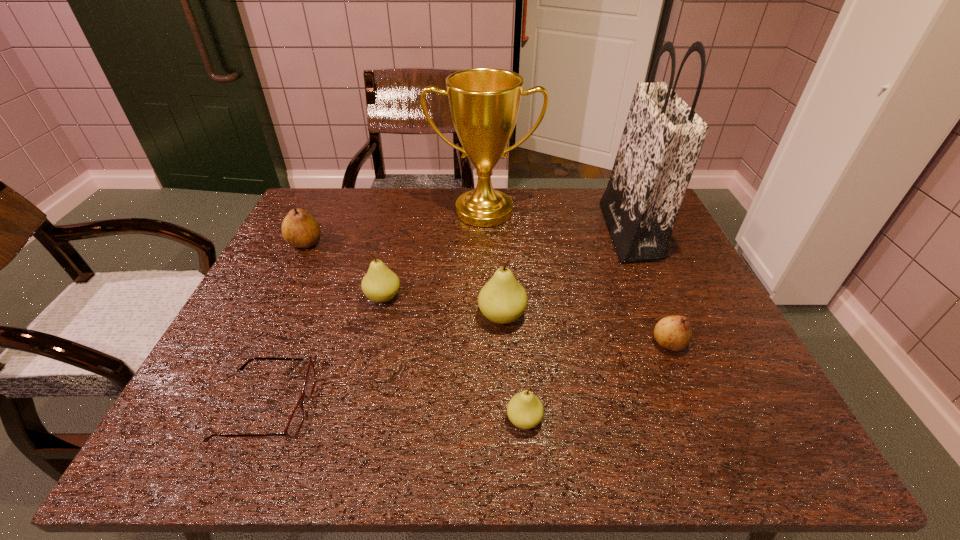
In order to click on spectacles present at the left edge in this screenshot , I will do `click(294, 424)`.

This screenshot has height=540, width=960. What are the coordinates of `shopping bag present at the right edge` in the screenshot? It's located at (662, 139).

Image resolution: width=960 pixels, height=540 pixels. Find the location of `pear located in the right edge section of the desktop`. pear located in the right edge section of the desktop is located at coordinates (674, 333).

This screenshot has width=960, height=540. Find the location of `object that is at the near left corner`. object that is at the near left corner is located at coordinates (294, 424).

Where is `object located in the far right corner section of the desktop`? This screenshot has height=540, width=960. object located in the far right corner section of the desktop is located at coordinates (662, 139).

At what (x,y) coordinates should I click in order to perform the action: click on vacant area at the far edge. Please return your answer as a coordinate pair (x, y). Image resolution: width=960 pixels, height=540 pixels. Looking at the image, I should click on (466, 225).

Where is `blank space at the near edge`? This screenshot has width=960, height=540. blank space at the near edge is located at coordinates (308, 438).

Image resolution: width=960 pixels, height=540 pixels. Identify the location of vacant space at the left edge of the desktop. (276, 353).

I want to click on free region at the right edge of the desktop, so click(x=735, y=402).

Locate an element on the screen. vacant space at the far left corner of the desktop is located at coordinates (341, 200).